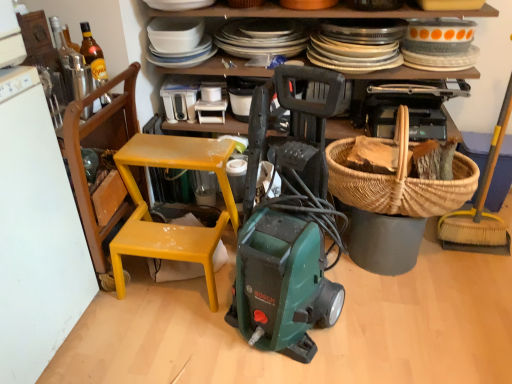
Question: From the image's perspective, is yellow plastic chair at left, marked as the second chair in a left-to-right arrangement, over brown woven picnic basket at center right?

Choices:
 (A) no
 (B) yes

Answer: (A)

Question: Is yellow plastic chair at left, the 1th chair when ordered from right to left, to the left of brown woven picnic basket at center right from the viewer's perspective?

Choices:
 (A) no
 (B) yes

Answer: (B)

Question: From the image's perspective, is yellow plastic chair at left, marked as the second chair in a left-to-right arrangement, located beneath brown woven picnic basket at center right?

Choices:
 (A) no
 (B) yes

Answer: (B)

Question: Can you confirm if yellow plastic chair at left, the 1th chair when ordered from right to left, is positioned to the right of brown woven picnic basket at center right?

Choices:
 (A) no
 (B) yes

Answer: (A)

Question: Can you confirm if yellow plastic chair at left, the 1th chair when ordered from right to left, is thinner than brown woven picnic basket at center right?

Choices:
 (A) yes
 (B) no

Answer: (B)

Question: From a real-world perspective, relative to yellow plastic chair at left, the 1th chair when ordered from right to left, is translucent glass bottle at upper left vertically above or below?

Choices:
 (A) below
 (B) above

Answer: (B)

Question: Is translucent glass bottle at upper left inside the boundaries of yellow plastic chair at left, marked as the second chair in a left-to-right arrangement, or outside?

Choices:
 (A) inside
 (B) outside

Answer: (B)

Question: Is translucent glass bottle at upper left to the left or to the right of yellow plastic chair at left, the 1th chair when ordered from right to left, in the image?

Choices:
 (A) right
 (B) left

Answer: (B)

Question: Considering the positions of translucent glass bottle at upper left and yellow plastic chair at left, marked as the second chair in a left-to-right arrangement, in the image, is translucent glass bottle at upper left wider or thinner than yellow plastic chair at left, marked as the second chair in a left-to-right arrangement,?

Choices:
 (A) wide
 (B) thin

Answer: (B)

Question: In terms of height, does metallic glass bottle at upper left, marked as the 2th appliance in a back-to-front arrangement, look taller or shorter compared to wooden chair at left, the 2th chair positioned from the right?

Choices:
 (A) tall
 (B) short

Answer: (B)

Question: Relative to wooden chair at left, the 2th chair positioned from the right, is metallic glass bottle at upper left, the second appliance from the right, in front or behind?

Choices:
 (A) front
 (B) behind

Answer: (B)

Question: Choose the correct answer: Is metallic glass bottle at upper left, marked as the 2th appliance in a back-to-front arrangement, inside wooden chair at left, the 2th chair positioned from the right, or outside it?

Choices:
 (A) inside
 (B) outside

Answer: (A)

Question: Considering the positions of metallic glass bottle at upper left, marked as the 2th appliance in a back-to-front arrangement, and wooden chair at left, the 2th chair positioned from the right, in the image, is metallic glass bottle at upper left, marked as the 2th appliance in a back-to-front arrangement, bigger or smaller than wooden chair at left, the 2th chair positioned from the right,?

Choices:
 (A) small
 (B) big

Answer: (A)

Question: Is metallic glass bottle at upper left, the second appliance from the right, in front of or behind white plastic toaster at upper center, which is counted as the first appliance, starting from the right, in the image?

Choices:
 (A) behind
 (B) front

Answer: (B)

Question: Is metallic glass bottle at upper left, the second appliance from the right, situated inside white plastic toaster at upper center, positioned as the 1th appliance in back-to-front order, or outside?

Choices:
 (A) outside
 (B) inside

Answer: (A)